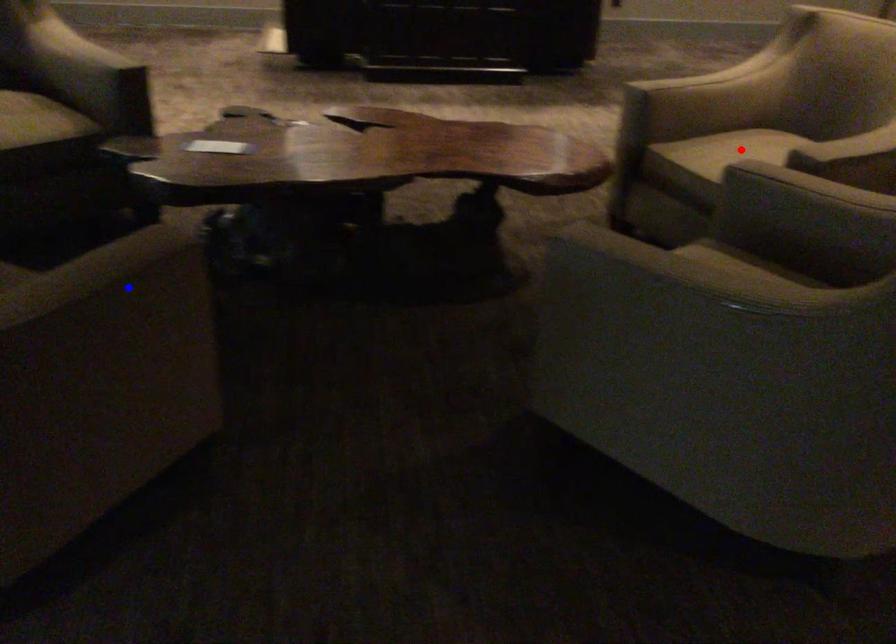
Question: In the image, two points are highlighted. Which point is nearer to the camera? Reply with the corresponding letter.

Choices:
 (A) blue point
 (B) red point

Answer: (A)